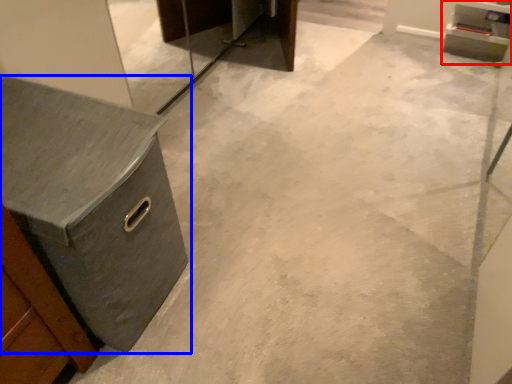
Question: Which object is closer to the camera taking this photo, cabinetry (highlighted by a red box) or chest of drawers (highlighted by a blue box)?

Choices:
 (A) cabinetry
 (B) chest of drawers

Answer: (B)